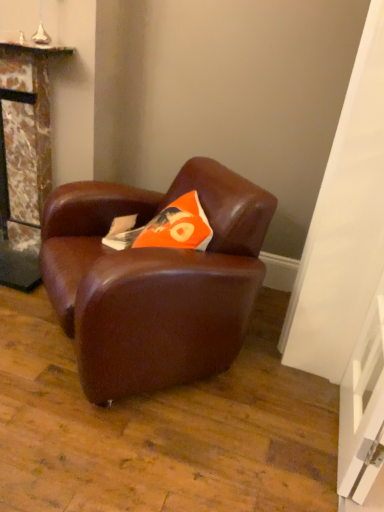
You are a GUI agent. You are given a task and a screenshot of the screen. Output one action in this format:
    pyautogui.click(x=<x>, y=<y>)
    Task: Click on the brown leather chair at center
    
    Given the screenshot: What is the action you would take?
    pyautogui.click(x=154, y=281)

The image size is (384, 512). Describe the element at coordinates (154, 281) in the screenshot. I see `brown leather chair at center` at that location.

Find the location of a particular element. The image size is (384, 512). brown leather chair at center is located at coordinates (154, 281).